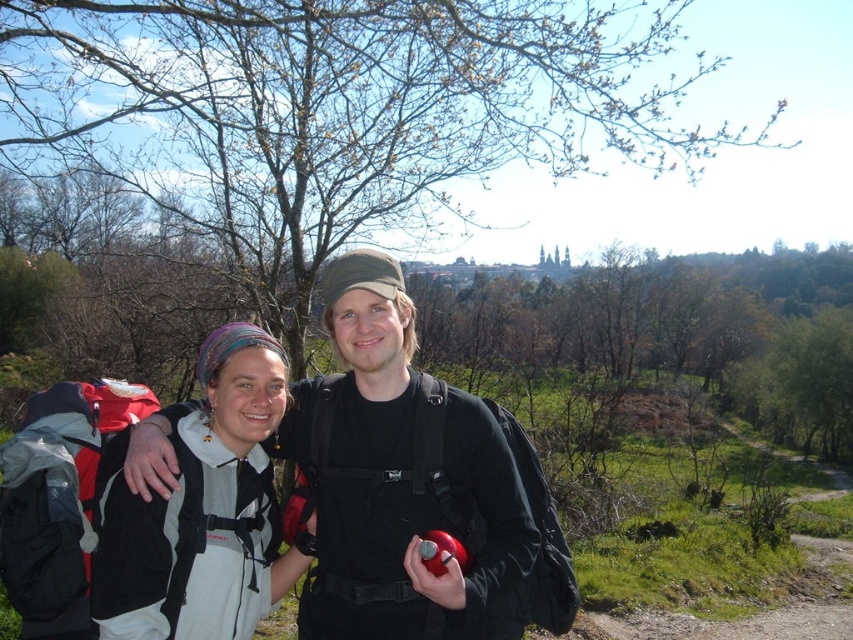
Question: Is matte black backpack at center smaller than white fleece jacket at center?

Choices:
 (A) no
 (B) yes

Answer: (A)

Question: Which point appears farthest from the camera in this image?

Choices:
 (A) (276, 365)
 (B) (384, 579)

Answer: (A)

Question: Observing the image, what is the correct spatial positioning of matte black backpack at center in reference to white fleece jacket at center?

Choices:
 (A) left
 (B) right

Answer: (B)

Question: Can you confirm if matte black backpack at center is positioned to the left of white fleece jacket at center?

Choices:
 (A) no
 (B) yes

Answer: (A)